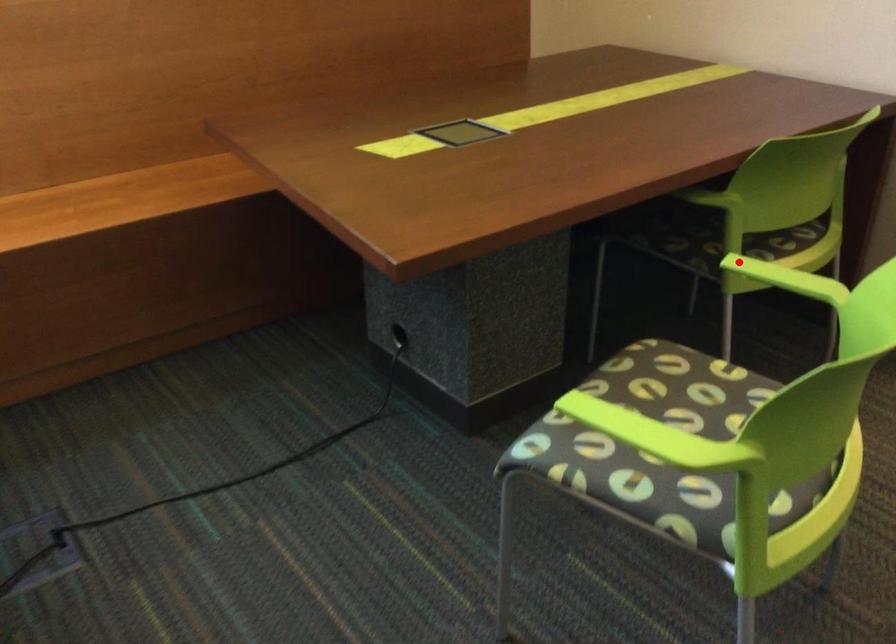
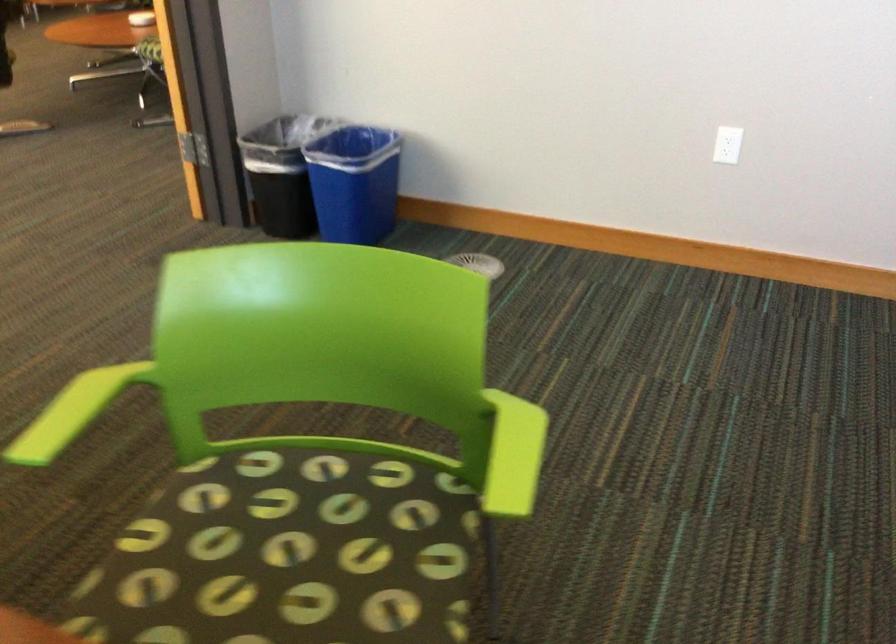
Question: I am providing you with two images of the same scene from different viewpoints. Image1 has a red point marked. In image2, the corresponding 3D location appears at what relative position? Reply with the corresponding letter.

Choices:
 (A) Closer
 (B) Farther

Answer: (A)